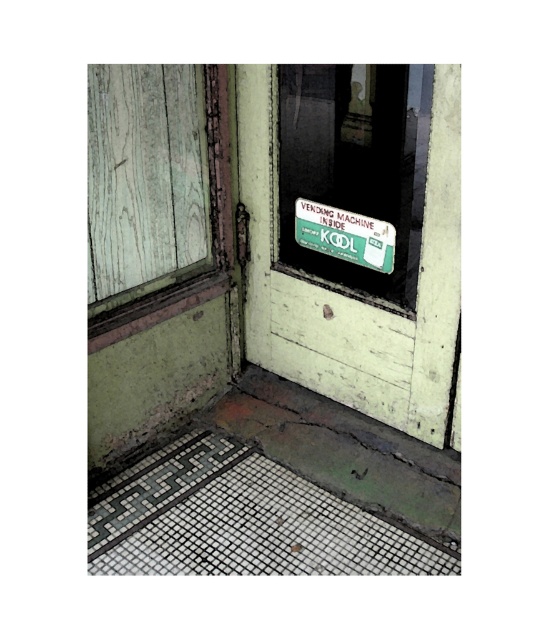
You are standing in the corner of an old building and see two points marked on the wall. The first point is at coordinates point (384, 218) and the second point is at point (372, 237). Which point is closer to you?

Point (384, 218) is closer to the viewer than point (372, 237).

You are standing in the corner of an old building and see a green matte sign at center and a green matte vending machine at upper center. Which object is larger in size?

The green matte sign at center is bigger than the green matte vending machine at upper center.

You are a painter who needs to decide which object to paint first. The green matte screen door at center and the weathered wood window at upper left are both in need of repair. Since you can only paint one today, which one should you choose if you want to paint the taller object?

The green matte screen door at center is taller than the weathered wood window at upper left, so you should paint the green matte screen door at center first.